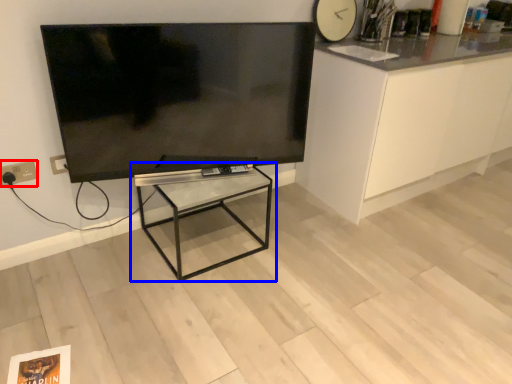
Question: Which point is further to the camera, electric outlet (highlighted by a red box) or table (highlighted by a blue box)?

Choices:
 (A) electric outlet
 (B) table

Answer: (A)